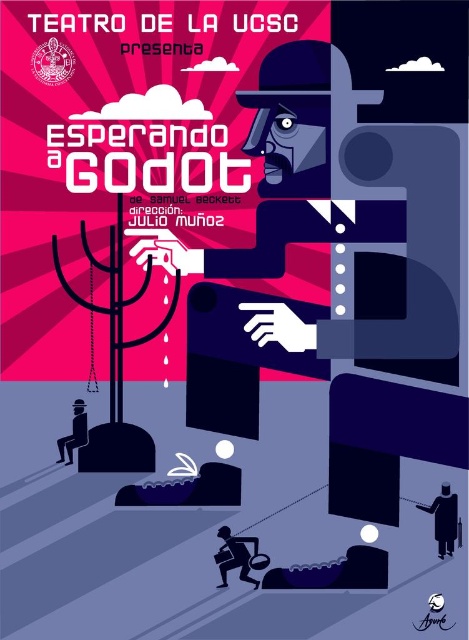
Between black matte person at lower right and matte black suit at lower left, which one is positioned lower?

Positioned lower is black matte person at lower right.

Which is behind, point (456, 518) or point (62, 445)?

Point (62, 445)

You are a GUI agent. You are given a task and a screenshot of the screen. Output one action in this format:
    pyautogui.click(x=<x>, y=<y>)
    Task: Click on the black matte person at lower right
    The height and width of the screenshot is (640, 469).
    Given the screenshot: What is the action you would take?
    pyautogui.click(x=445, y=518)

Looking at this image, is black matte person at lower right below silhouette paper bag at lower center?

No, black matte person at lower right is not below silhouette paper bag at lower center.

This screenshot has width=469, height=640. I want to click on black matte person at lower right, so click(445, 518).

Does silhouette paper bag at lower center appear on the left side of matte black suit at lower left?

Incorrect, silhouette paper bag at lower center is not on the left side of matte black suit at lower left.

Who is more forward, [219,560] or [60,454]?

Point [219,560]

Does point (237, 540) come in front of point (77, 404)?

Yes.

At what (x,y) coordinates should I click in order to perform the action: click on silhouette paper bag at lower center. Please return your answer as a coordinate pair (x, y). Looking at the image, I should click on click(234, 556).